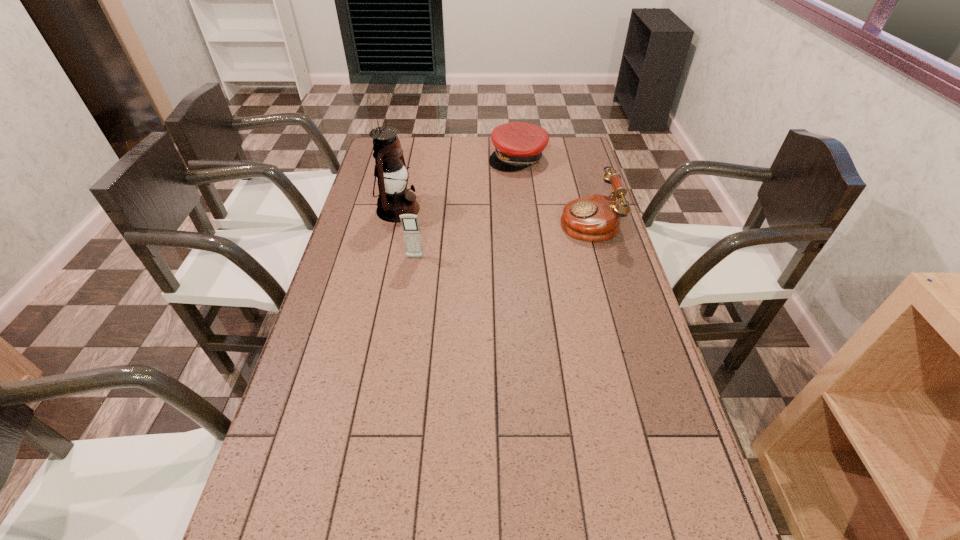
Locate an element on the screen. This screenshot has width=960, height=540. blank region between the farthest object and the nearest object is located at coordinates (467, 208).

Image resolution: width=960 pixels, height=540 pixels. What are the coordinates of `free space between the shortest object and the telephone` in the screenshot? It's located at (553, 189).

Locate an element on the screen. Image resolution: width=960 pixels, height=540 pixels. object identified as the second closest to the rightmost object is located at coordinates (410, 225).

Select which object appears as the third closest to the cellular telephone. Please provide its 2D coordinates. Your answer should be formatted as a tuple, i.e. [(x, y)], where the tuple contains the x and y coordinates of a point satisfying the conditions above.

[(518, 145)]

At what (x,y) coordinates should I click in order to perform the action: click on vacant space that satisfies the following two spatial constraints: 1. on the front side of the rightmost object; 2. on the dial of the second object from right to left. Please return your answer as a coordinate pair (x, y). Looking at the image, I should click on (525, 220).